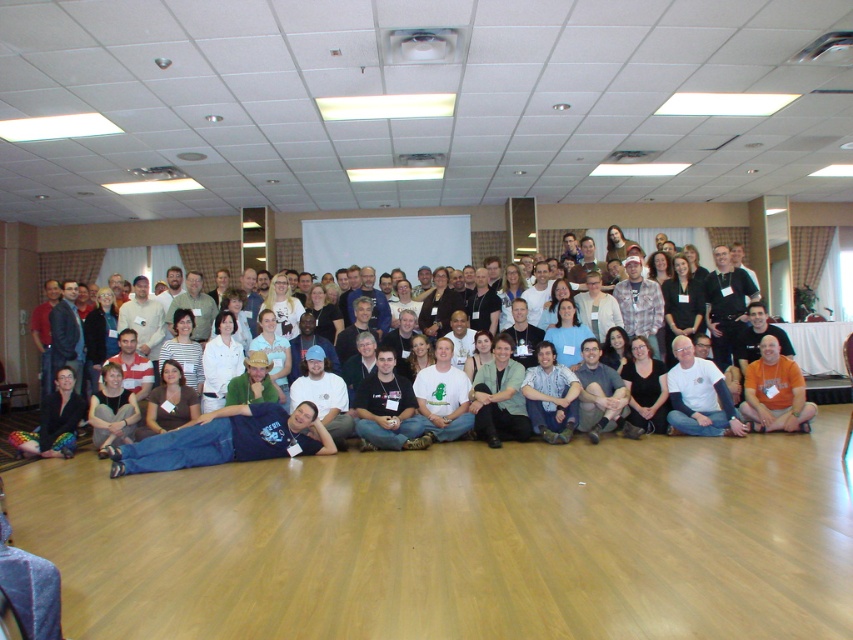
Question: Is blue denim jeans at lower center further to camera compared to white t-shirt at center?

Choices:
 (A) yes
 (B) no

Answer: (B)

Question: Among these points, which one is nearest to the camera?

Choices:
 (A) (10, 456)
 (B) (247, 444)

Answer: (B)

Question: Is blue denim jeans at lower center below white t-shirt at center?

Choices:
 (A) no
 (B) yes

Answer: (B)

Question: Which object is farther from the camera taking this photo?

Choices:
 (A) blue denim jeans at lower center
 (B) white t-shirt at center

Answer: (B)

Question: Is blue denim jeans at lower center wider than white t-shirt at center?

Choices:
 (A) no
 (B) yes

Answer: (B)